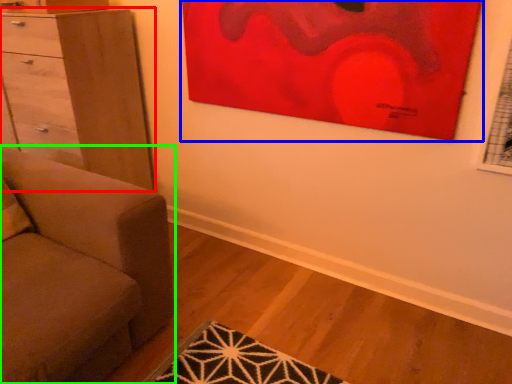
Question: Based on their relative distances, which object is farther from chest of drawers (highlighted by a red box)? Choose from picture frame (highlighted by a blue box) and studio couch (highlighted by a green box).

Choices:
 (A) picture frame
 (B) studio couch

Answer: (A)